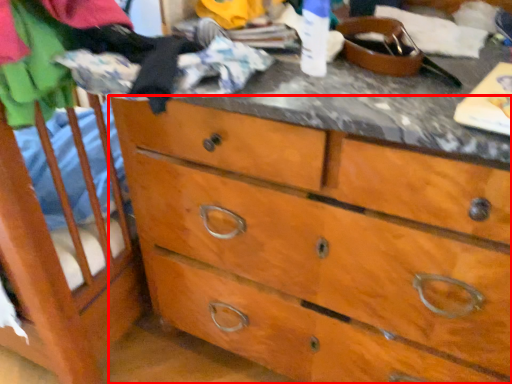
Question: From the image's perspective, what is the correct spatial relationship of chest of drawers (annotated by the red box) in relation to clothing?

Choices:
 (A) above
 (B) below

Answer: (B)